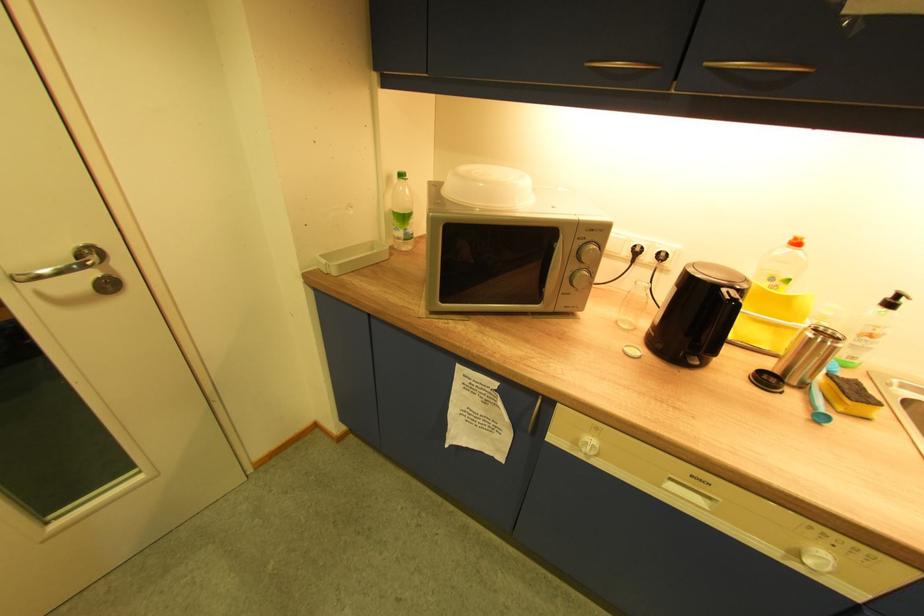
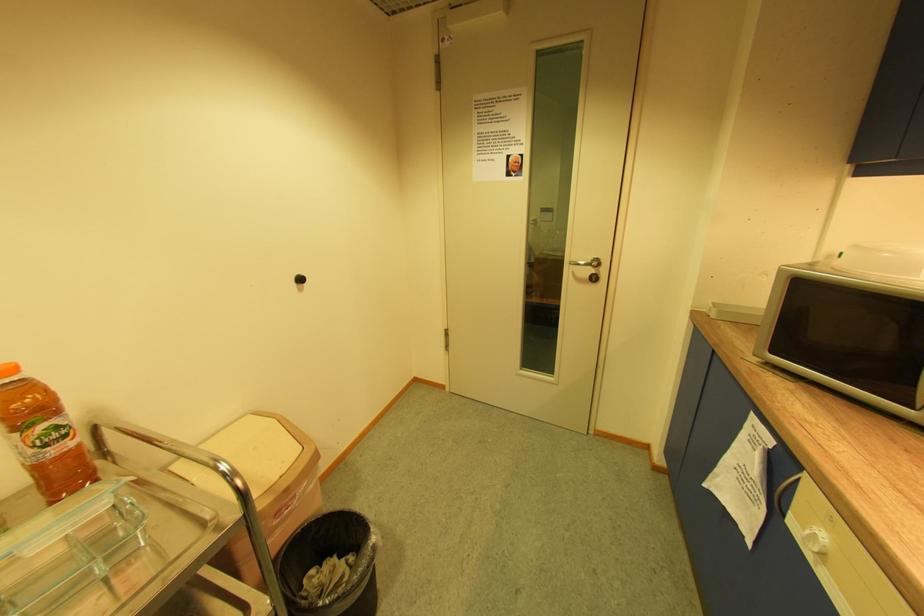
In the second image, find the point that corresponds to [98,275] in the first image.

(598, 272)